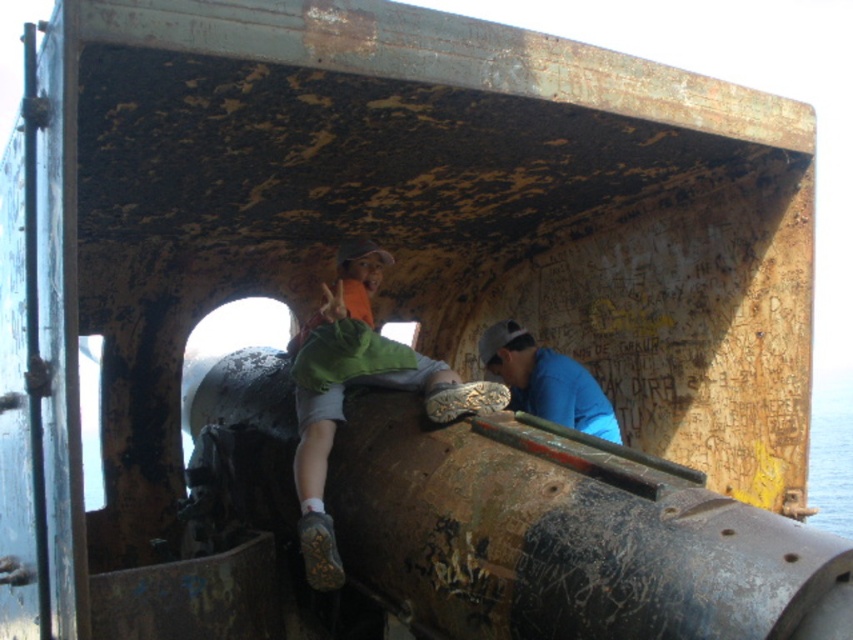
You are a photographer inside the cargo hold and want to capture both the green fabric shirt at center and the blue matte shirt at center in the same frame. Which of the two should you position closer to the camera to ensure both are fully visible?

The blue matte shirt at center should be positioned closer to the camera because it is shorter than the green fabric shirt at center, allowing both to fit within the frame when the shorter one is nearer.

You are standing at the origin of the coordinate system in the image. You see a point at position (357,384). Which object is this point located on?

The point at position (357,384) is located on the green fabric shirt at center.